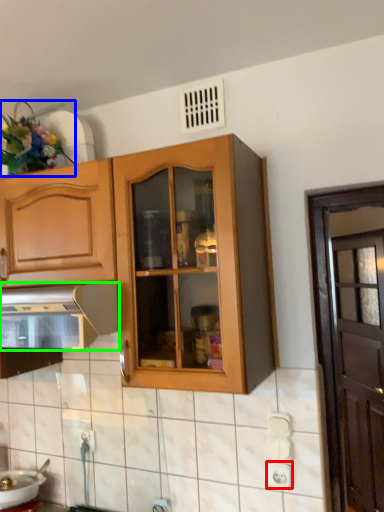
Question: Based on their relative distances, which object is nearer to electric outlet (highlighted by a red box)? Choose from flower (highlighted by a blue box) and kitchen appliance (highlighted by a green box).

Choices:
 (A) flower
 (B) kitchen appliance

Answer: (B)